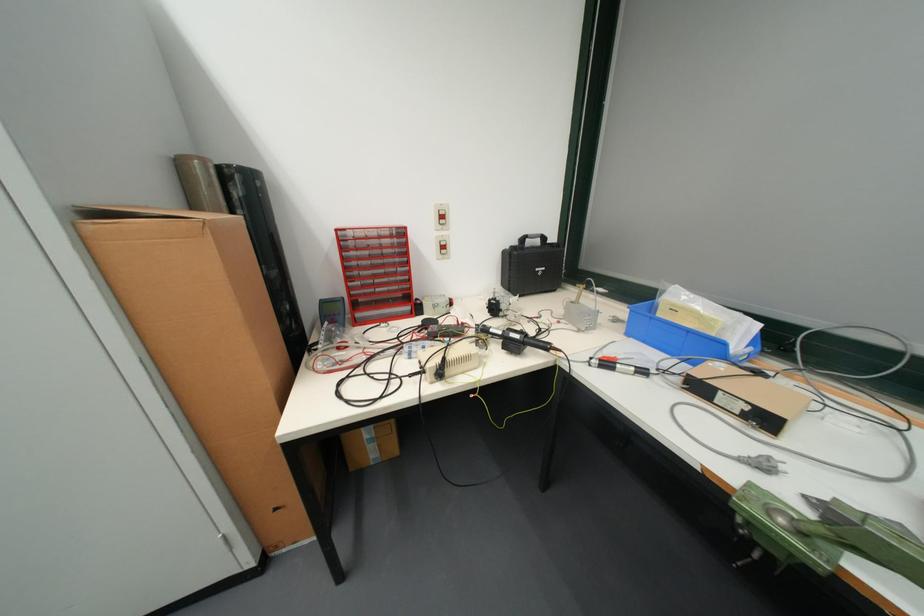
The location [210,346] corresponds to which object?

It refers to a large cardboard box.